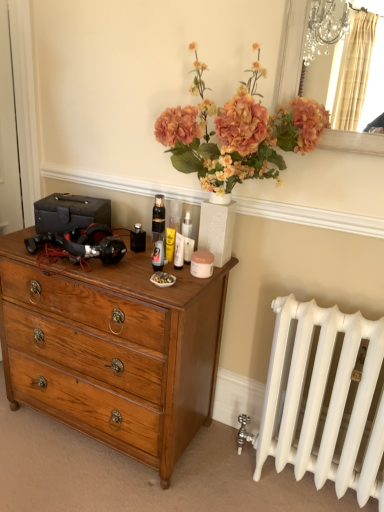
Question: Would you say white glossy lotion at center is outside silver/metallic mirror at upper right?

Choices:
 (A) yes
 (B) no

Answer: (A)

Question: Does white glossy lotion at center have a lesser width compared to silver/metallic mirror at upper right?

Choices:
 (A) no
 (B) yes

Answer: (B)

Question: From a real-world perspective, is white glossy lotion at center over silver/metallic mirror at upper right?

Choices:
 (A) no
 (B) yes

Answer: (A)

Question: Is white glossy lotion at center facing away from silver/metallic mirror at upper right?

Choices:
 (A) yes
 (B) no

Answer: (B)

Question: Is white glossy lotion at center positioned in front of silver/metallic mirror at upper right?

Choices:
 (A) no
 (B) yes

Answer: (A)

Question: In terms of size, does white glossy lotion at center appear bigger or smaller than silver/metallic mirror at upper right?

Choices:
 (A) small
 (B) big

Answer: (A)

Question: From the image's perspective, is white glossy lotion at center located above or below silver/metallic mirror at upper right?

Choices:
 (A) above
 (B) below

Answer: (B)

Question: Do you think white glossy lotion at center is within silver/metallic mirror at upper right, or outside of it?

Choices:
 (A) outside
 (B) inside

Answer: (A)

Question: From a real-world perspective, is white glossy lotion at center positioned above or below silver/metallic mirror at upper right?

Choices:
 (A) below
 (B) above

Answer: (A)

Question: Based on their sizes in the image, would you say wooden chest of drawers at left is bigger or smaller than silver/metallic mirror at upper right?

Choices:
 (A) small
 (B) big

Answer: (B)

Question: From the image's perspective, relative to silver/metallic mirror at upper right, is wooden chest of drawers at left above or below?

Choices:
 (A) below
 (B) above

Answer: (A)

Question: In the image, is wooden chest of drawers at left positioned in front of or behind silver/metallic mirror at upper right?

Choices:
 (A) behind
 (B) front

Answer: (A)

Question: From a real-world perspective, is wooden chest of drawers at left positioned above or below silver/metallic mirror at upper right?

Choices:
 (A) below
 (B) above

Answer: (A)

Question: From the image's perspective, relative to wooden chest of drawers at left, is silver/metallic mirror at upper right above or below?

Choices:
 (A) below
 (B) above

Answer: (B)

Question: Does point (364, 153) appear closer or farther from the camera than point (66, 307)?

Choices:
 (A) farther
 (B) closer

Answer: (B)